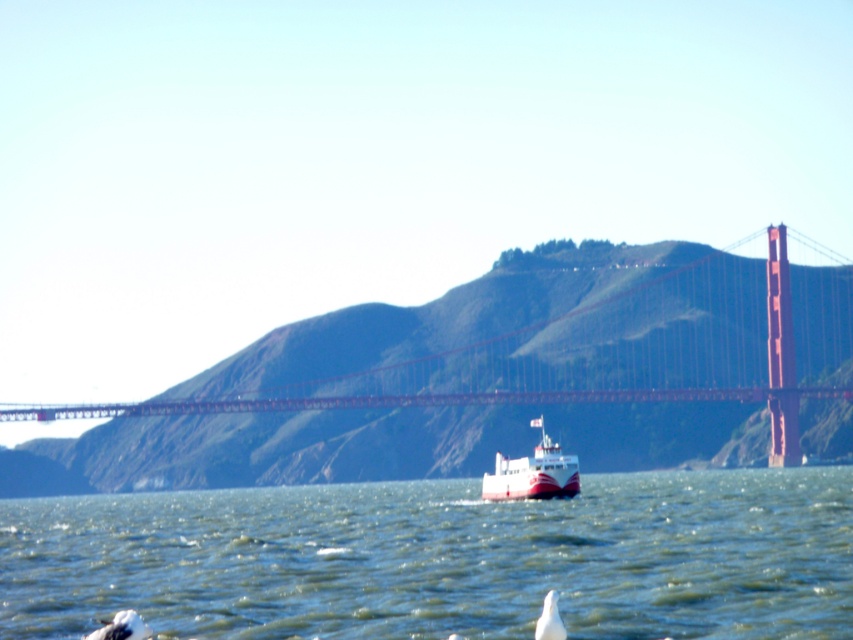
Question: Which of the following is the closest to the observer?

Choices:
 (A) white matte bird at lower left
 (B) white matte bird at lower center
 (C) white glossy ferry at center

Answer: (B)

Question: In this image, where is white matte bird at lower left located relative to white matte bird at lower center?

Choices:
 (A) below
 (B) above

Answer: (A)

Question: Estimate the real-world distances between objects in this image. Which object is closer to the metallic red bridge at center?

Choices:
 (A) greenish water at center
 (B) white matte bird at lower left
 (C) white matte bird at lower center
 (D) white glossy ferry at center

Answer: (A)

Question: Which point is closer to the camera taking this photo?

Choices:
 (A) (364, 621)
 (B) (114, 624)
 (C) (410, 378)

Answer: (B)

Question: Can you confirm if white glossy ferry at center is positioned to the right of white matte bird at lower left?

Choices:
 (A) yes
 (B) no

Answer: (A)

Question: Is greenish water at center in front of white matte bird at lower left?

Choices:
 (A) no
 (B) yes

Answer: (A)